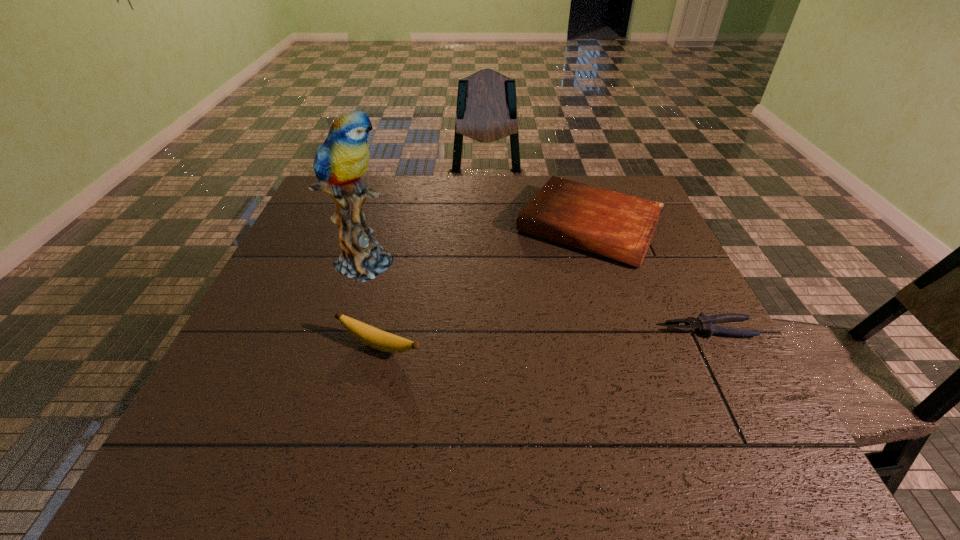
Where is `banana`? banana is located at coordinates click(373, 337).

The image size is (960, 540). In order to click on the shortest object in this screenshot , I will do `click(705, 324)`.

Where is `Bible`? The image size is (960, 540). Bible is located at coordinates (618, 226).

Where is `the tallest object`? the tallest object is located at coordinates (340, 161).

Locate an element on the screen. free space located 0.130m on the left of the banana is located at coordinates (274, 346).

Where is `vacant space situated 0.360m at the gripping part of the shortest object`? vacant space situated 0.360m at the gripping part of the shortest object is located at coordinates (502, 329).

Where is `vacant space located at the gripping part of the shortest object`? The width and height of the screenshot is (960, 540). vacant space located at the gripping part of the shortest object is located at coordinates (588, 329).

You are a GUI agent. You are given a task and a screenshot of the screen. Output one action in this format:
    pyautogui.click(x=<x>, y=<y>)
    Task: Click on the vacant point located at the gripping part of the shortest object
    
    Given the screenshot: What is the action you would take?
    pyautogui.click(x=525, y=329)

The image size is (960, 540). In order to click on free location located 0.110m on the spine side of the Bible in this screenshot , I will do `click(545, 290)`.

Locate an element on the screen. The height and width of the screenshot is (540, 960). vacant area situated 0.100m on the spine side of the Bible is located at coordinates (546, 288).